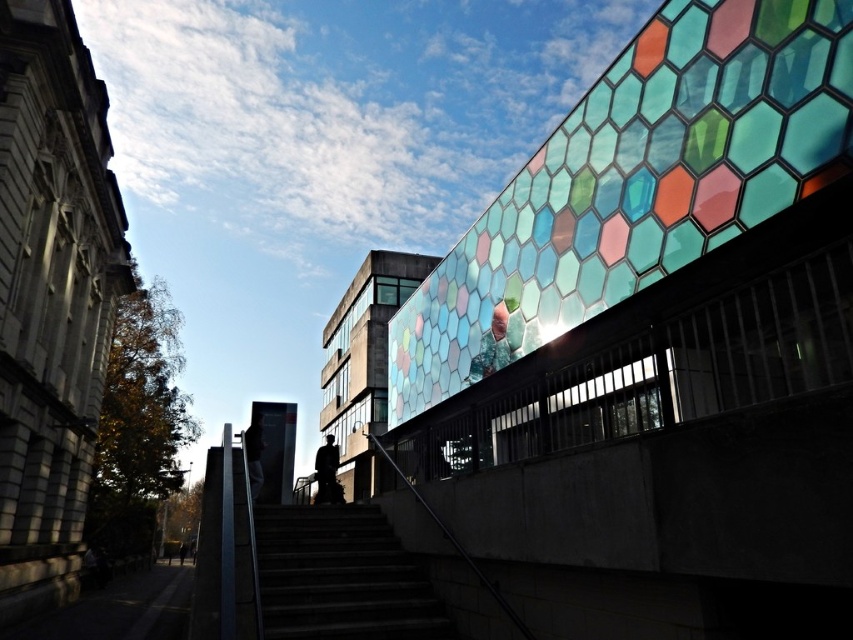
You are standing at the base of the stairs leading to the entrance of the building. You want to take a photo of the multicolored hexagonal glass at upper right. To ensure it is centered in your camera frame, where should you position yourself relative to the building?

To center the multicolored hexagonal glass at upper right in your camera frame, position yourself so that the glass is aligned with the point at 0.289 on the horizontal axis and 0.747 on the vertical axis relative to the building facade.

You are standing at the base of the stairs leading to the entrance of the modern building with the hexagonal mosaic facade. You see a point marked at coordinates (636,184). Can you tell me what this point is located on?

The point at coordinates (636,184) is located on the multicolored hexagonal glass at upper right.

You are an architect designing a new building and want to incorporate elements from this scene. If you want to emphasize the multicolored hexagonal glass at upper right more than the dark concrete stairs at center, which element should you make larger in your design?

The multicolored hexagonal glass at upper right is already larger in size than the dark concrete stairs at center, so to emphasize it further, you should keep it larger than the dark concrete stairs at center in your design.